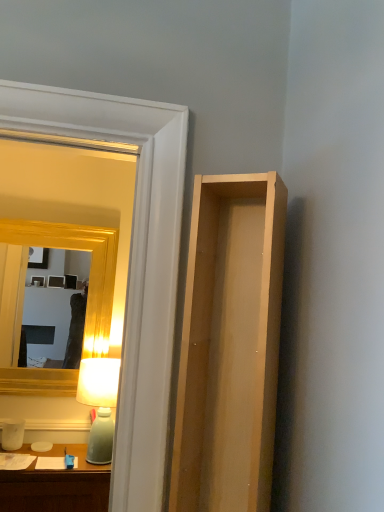
The width and height of the screenshot is (384, 512). Find the location of `free space above gold wooden mirror at upper left (from a real-world perspective)`. free space above gold wooden mirror at upper left (from a real-world perspective) is located at coordinates (54, 221).